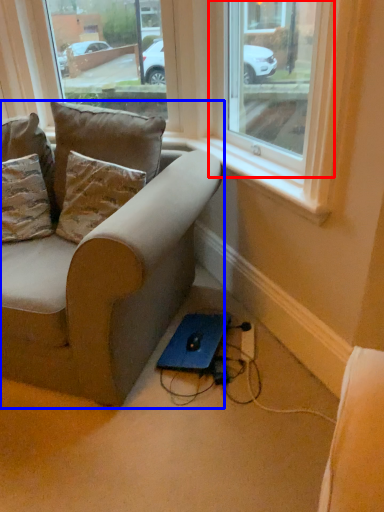
Question: Which of the following is the closest to the observer, window (highlighted by a red box) or studio couch (highlighted by a blue box)?

Choices:
 (A) window
 (B) studio couch

Answer: (A)